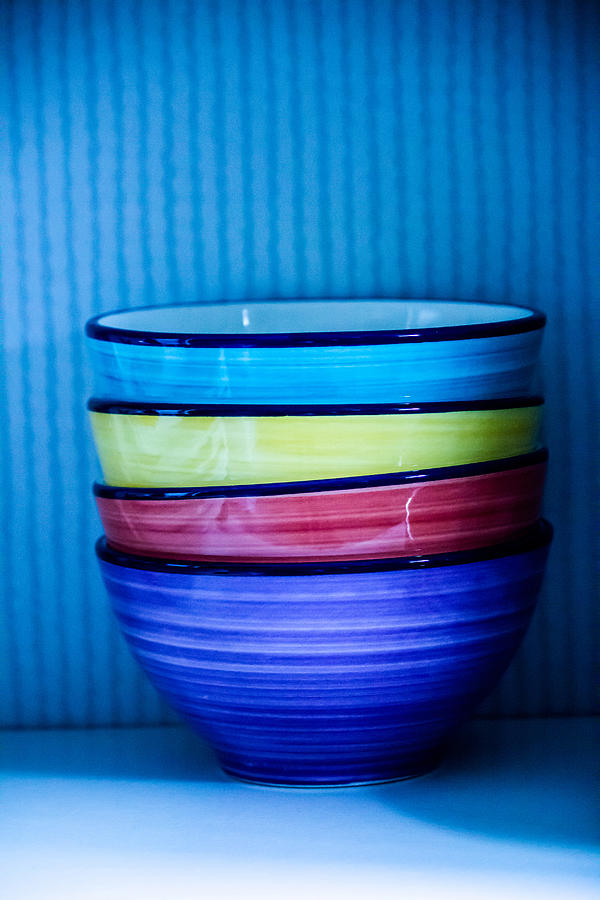
Identify the location of red bowl. The image size is (600, 900). (326, 540).